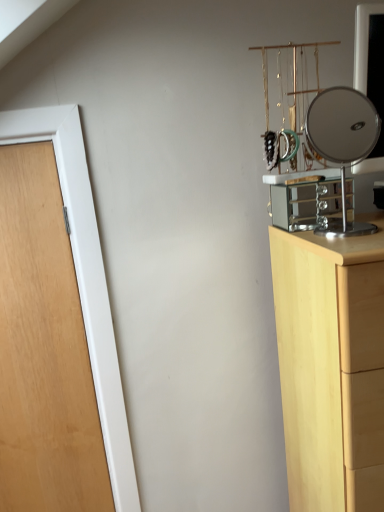
Measure the distance between point (93, 438) and camera.

They are 4.40 feet apart.

At what (x,y) coordinates should I click in order to perform the action: click on wooden door at left. Please return your answer as a coordinate pair (x, y). The height and width of the screenshot is (512, 384). Looking at the image, I should click on (44, 350).

Is wooden door at left to the right of light wood chest of drawers at right from the viewer's perspective?

No.

Measure the distance between wooden door at left and light wood chest of drawers at right.

27.89 inches.

Between wooden door at left and light wood chest of drawers at right, which one is positioned in front?

light wood chest of drawers at right is in front.

Is wooden door at left aimed at light wood chest of drawers at right?

No, wooden door at left does not turn towards light wood chest of drawers at right.

From the picture: Can you confirm if light wood chest of drawers at right is wider than wooden door at left?

Indeed, light wood chest of drawers at right has a greater width compared to wooden door at left.

Is light wood chest of drawers at right positioned with its back to wooden door at left?

No.

From the image's perspective, is light wood chest of drawers at right located above or below wooden door at left?

light wood chest of drawers at right is situated lower than wooden door at left in the image.

Can you confirm if light wood chest of drawers at right is positioned to the right of polished silver mirror at right?

Yes, light wood chest of drawers at right is to the right of polished silver mirror at right.

Is polished silver mirror at right at the back of light wood chest of drawers at right?

light wood chest of drawers at right is not turned away from polished silver mirror at right.

Relative to polished silver mirror at right, is light wood chest of drawers at right in front or behind?

Visually, light wood chest of drawers at right is located in front of polished silver mirror at right.

Who is bigger, light wood chest of drawers at right or polished silver mirror at right?

Bigger between the two is light wood chest of drawers at right.

What's the angular difference between polished silver mirror at right and wooden door at left's facing directions?

They differ by 0.741 degrees in their facing directions.

Is polished silver mirror at right behind wooden door at left?

No, it is in front of wooden door at left.

Does polished silver mirror at right have a larger size compared to wooden door at left?

Incorrect, polished silver mirror at right is not larger than wooden door at left.

From the image's perspective, which object appears higher, polished silver mirror at right or light wood chest of drawers at right?

polished silver mirror at right is shown above in the image.

In the scene shown: Can you see polished silver mirror at right touching light wood chest of drawers at right?

No.

Is polished silver mirror at right closer to camera compared to light wood chest of drawers at right?

No, it is not.

Does polished silver mirror at right have a lesser width compared to light wood chest of drawers at right?

Yes.

From the image's perspective, which object appears higher, wooden door at left or polished silver mirror at right?

polished silver mirror at right appears higher in the image.

What are the coordinates of `mirror in front of the wooden door at left` in the screenshot? It's located at (343, 142).

Is wooden door at left turned away from polished silver mirror at right?

No, wooden door at left is not facing away from polished silver mirror at right.

Which of these two, wooden door at left or polished silver mirror at right, stands taller?

wooden door at left.

Where is `the chest of drawers in front of the wooden door at left`? the chest of drawers in front of the wooden door at left is located at coordinates (328, 359).

You are a GUI agent. You are given a task and a screenshot of the screen. Output one action in this format:
    pyautogui.click(x=<x>, y=<y>)
    Task: Click on the chest of drawers on the right of the wooden door at left
    This screenshot has width=384, height=512.
    Given the screenshot: What is the action you would take?
    pyautogui.click(x=328, y=359)

Which object lies further to the anchor point wooden door at left, light wood chest of drawers at right or polished silver mirror at right?

The object further to wooden door at left is polished silver mirror at right.

Looking at the image, which one is located further to light wood chest of drawers at right, wooden door at left or polished silver mirror at right?

Among the two, polished silver mirror at right is located further to light wood chest of drawers at right.

Looking at the image, which one is located closer to polished silver mirror at right, light wood chest of drawers at right or wooden door at left?

light wood chest of drawers at right is positioned closer to the anchor polished silver mirror at right.

From the image, which object appears to be nearer to wooden door at left, polished silver mirror at right or light wood chest of drawers at right?

light wood chest of drawers at right lies closer to wooden door at left than the other object.

Estimate the real-world distances between objects in this image. Which object is closer to polished silver mirror at right, wooden door at left or light wood chest of drawers at right?

light wood chest of drawers at right lies closer to polished silver mirror at right than the other object.

Estimate the real-world distances between objects in this image. Which object is further from light wood chest of drawers at right, polished silver mirror at right or wooden door at left?

polished silver mirror at right is further to light wood chest of drawers at right.

Locate an element on the screen. The height and width of the screenshot is (512, 384). mirror between wooden door at left and light wood chest of drawers at right in the horizontal direction is located at coordinates (343, 142).